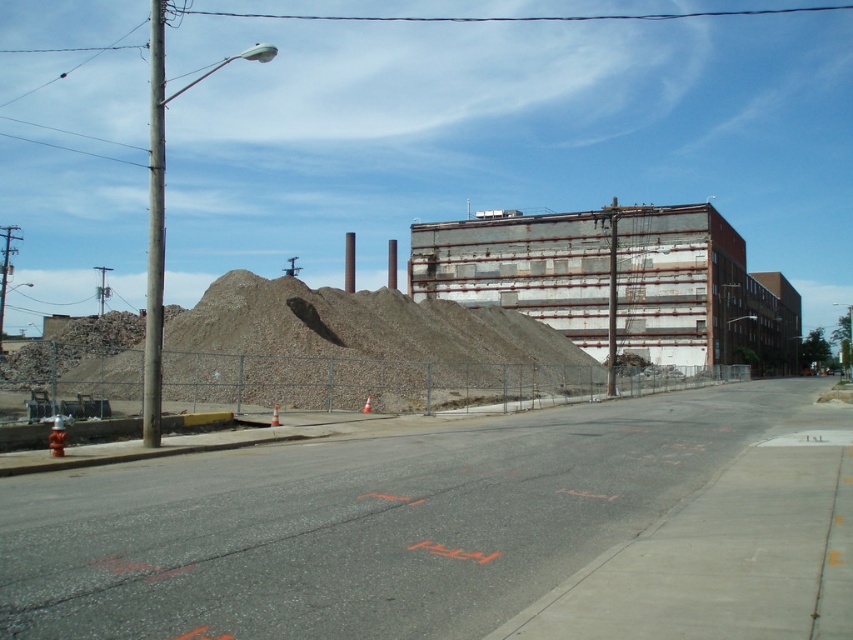
Question: Which object appears closest to the camera in this image?

Choices:
 (A) gray gravel pile at center
 (B) rusty metal building at center

Answer: (A)

Question: Is gray gravel pile at center bigger than rusty metal building at center?

Choices:
 (A) no
 (B) yes

Answer: (A)

Question: Which point is farther to the camera?

Choices:
 (A) gray gravel pile at center
 (B) rusty metal building at center

Answer: (B)

Question: Is gray gravel pile at center to the right of rusty metal building at center from the viewer's perspective?

Choices:
 (A) no
 (B) yes

Answer: (A)

Question: Does gray gravel pile at center appear under rusty metal building at center?

Choices:
 (A) yes
 (B) no

Answer: (A)